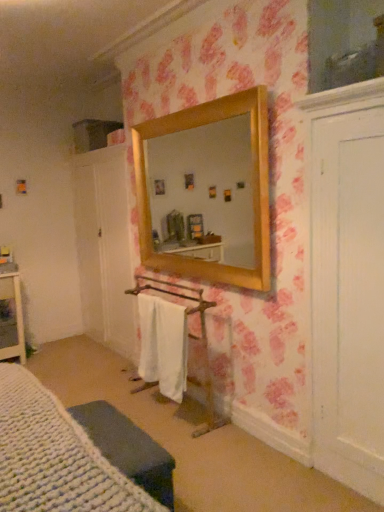
Question: Are white knitted bed at lower left and white cotton bath towel at center making contact?

Choices:
 (A) no
 (B) yes

Answer: (A)

Question: Does white knitted bed at lower left appear on the right side of white cotton bath towel at center?

Choices:
 (A) yes
 (B) no

Answer: (B)

Question: Does white knitted bed at lower left have a greater height compared to white cotton bath towel at center?

Choices:
 (A) yes
 (B) no

Answer: (B)

Question: From a real-world perspective, is white knitted bed at lower left positioned over white cotton bath towel at center based on gravity?

Choices:
 (A) yes
 (B) no

Answer: (A)

Question: Does white knitted bed at lower left have a smaller size compared to white cotton bath towel at center?

Choices:
 (A) yes
 (B) no

Answer: (B)

Question: Is white cotton bath towel at center completely or partially inside white knitted bed at lower left?

Choices:
 (A) yes
 (B) no

Answer: (B)

Question: From a real-world perspective, is white cotton bath towel at center over knitted fabric cushion at lower left?

Choices:
 (A) yes
 (B) no

Answer: (A)

Question: Are white cotton bath towel at center and knitted fabric cushion at lower left making contact?

Choices:
 (A) yes
 (B) no

Answer: (B)

Question: Is white cotton bath towel at center positioned far away from knitted fabric cushion at lower left?

Choices:
 (A) yes
 (B) no

Answer: (B)

Question: Considering the relative positions of white cotton bath towel at center and knitted fabric cushion at lower left in the image provided, is white cotton bath towel at center to the left of knitted fabric cushion at lower left from the viewer's perspective?

Choices:
 (A) yes
 (B) no

Answer: (B)

Question: From a real-world perspective, does white cotton bath towel at center sit lower than knitted fabric cushion at lower left?

Choices:
 (A) no
 (B) yes

Answer: (A)

Question: From the image's perspective, is white cotton bath towel at center beneath knitted fabric cushion at lower left?

Choices:
 (A) no
 (B) yes

Answer: (A)

Question: Is knitted fabric cushion at lower left smaller than white knitted bed at lower left?

Choices:
 (A) yes
 (B) no

Answer: (A)